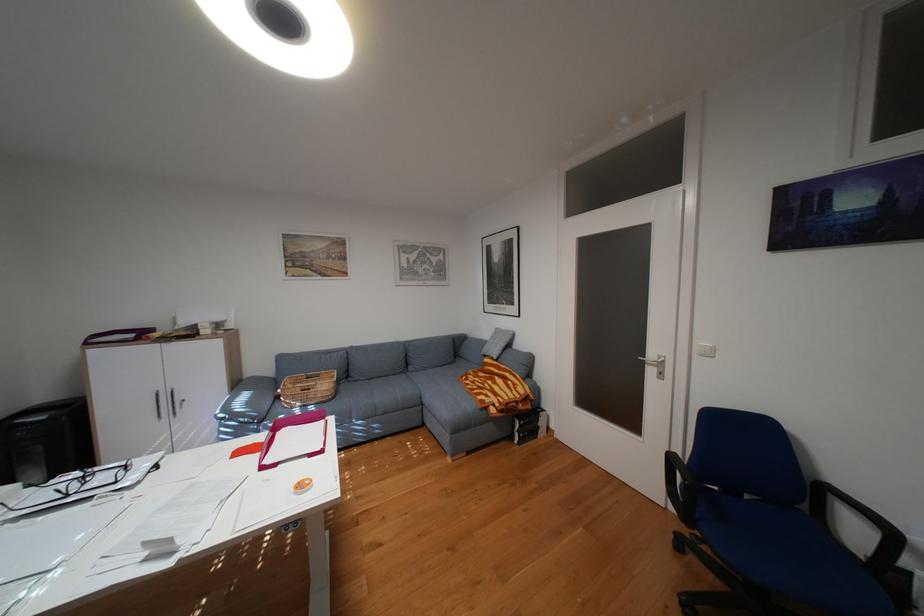
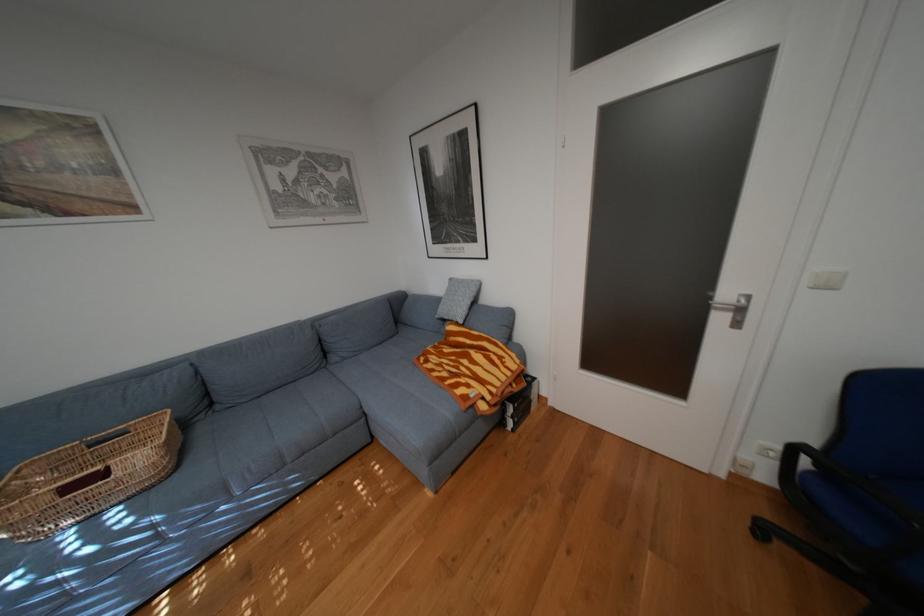
Question: The camera is either moving clockwise (left) or counter-clockwise (right) around the object. The first image is from the beginning of the video and the second image is from the end. Is the camera moving left or right when shooting the video?

Choices:
 (A) Left
 (B) Right

Answer: (A)